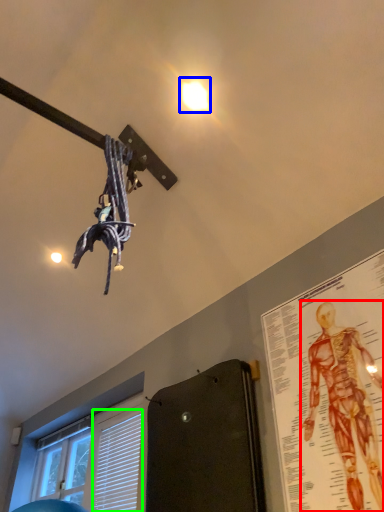
Question: Which object is positioned farthest from person (highlighted by a red box)? Select from droplight (highlighted by a blue box) and blind (highlighted by a green box).

Choices:
 (A) droplight
 (B) blind

Answer: (B)